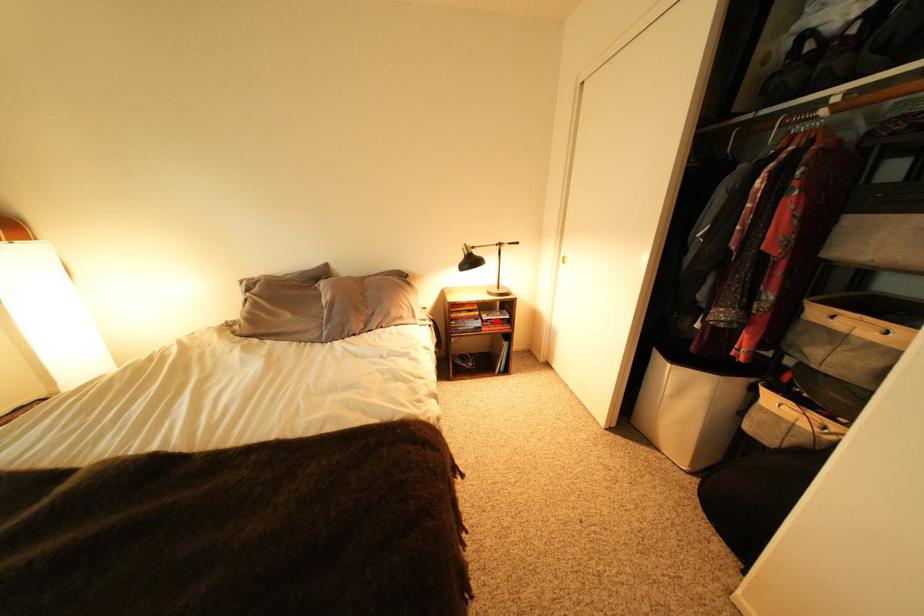
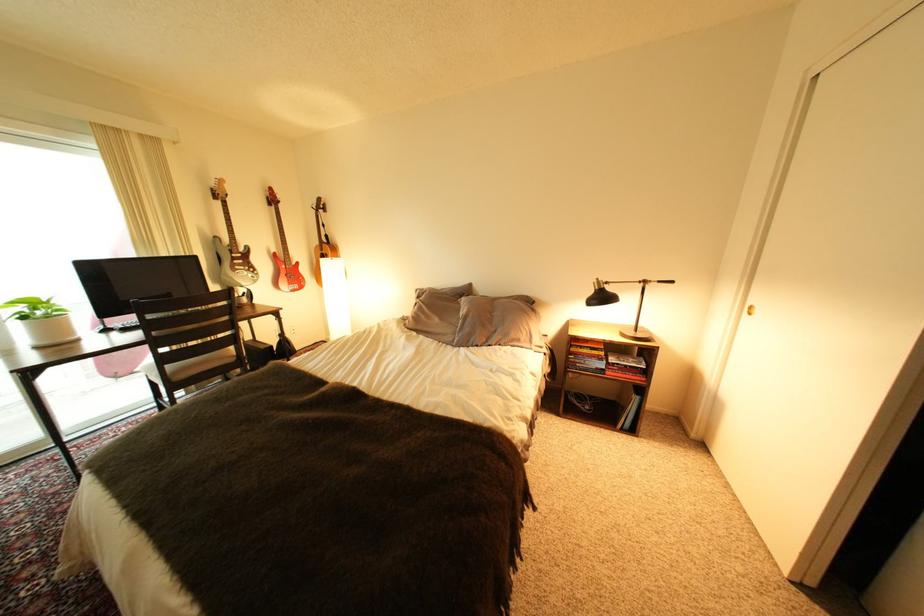
Where in the second image is the point corresponding to the highlighted location from the first image?

(623, 363)